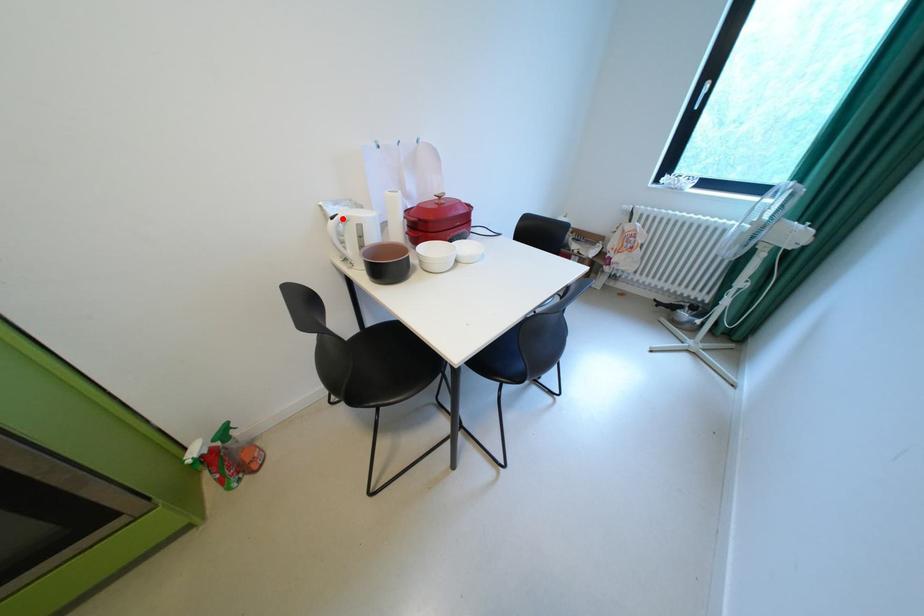
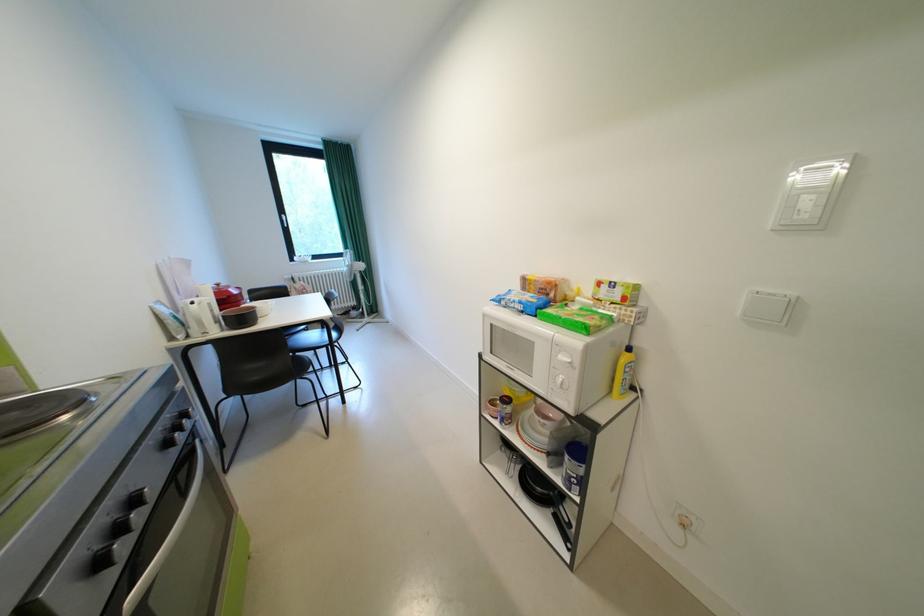
In the second image, find the point that corresponds to the highlighted location in the first image.

(203, 304)